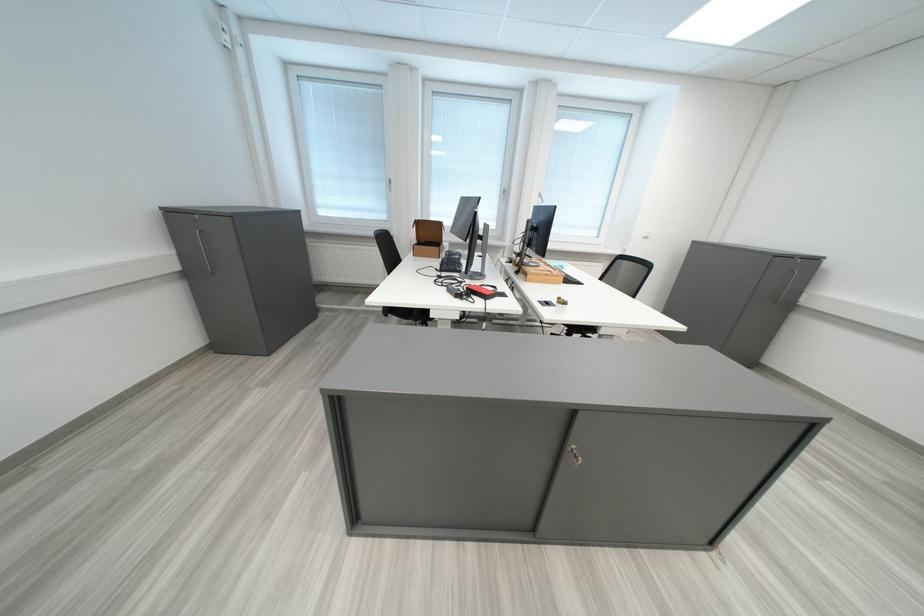
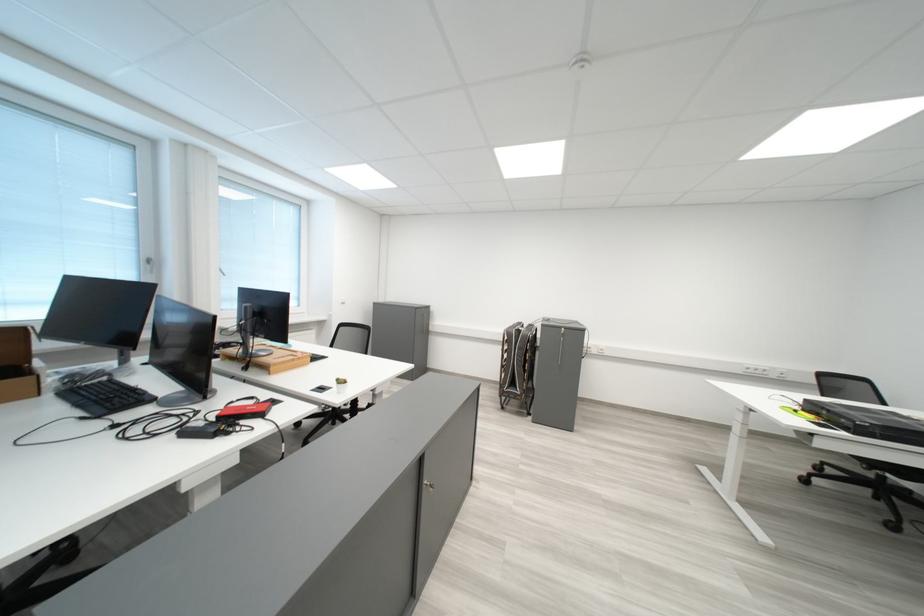
The point at (539, 276) is marked in the first image. Where is the corresponding point in the second image?

(277, 369)